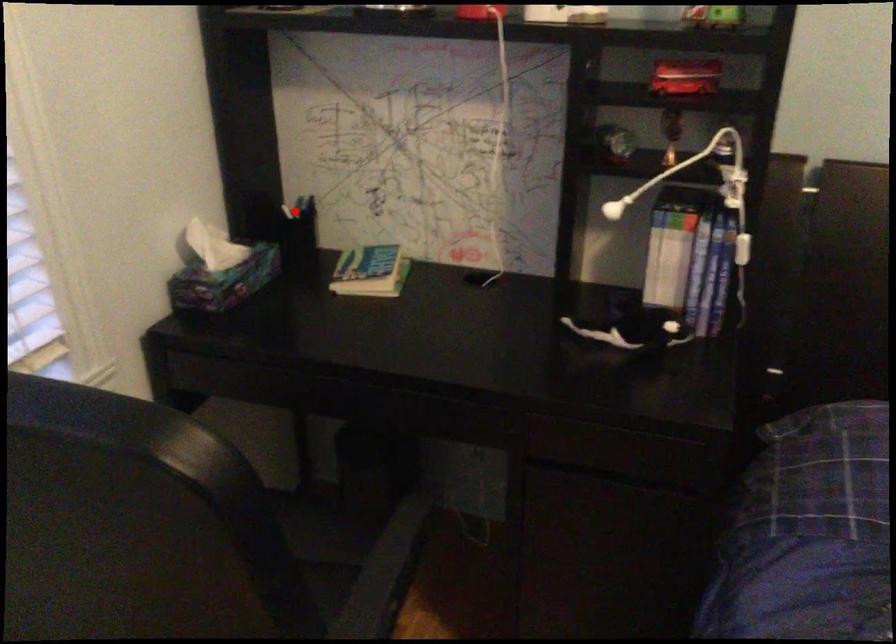
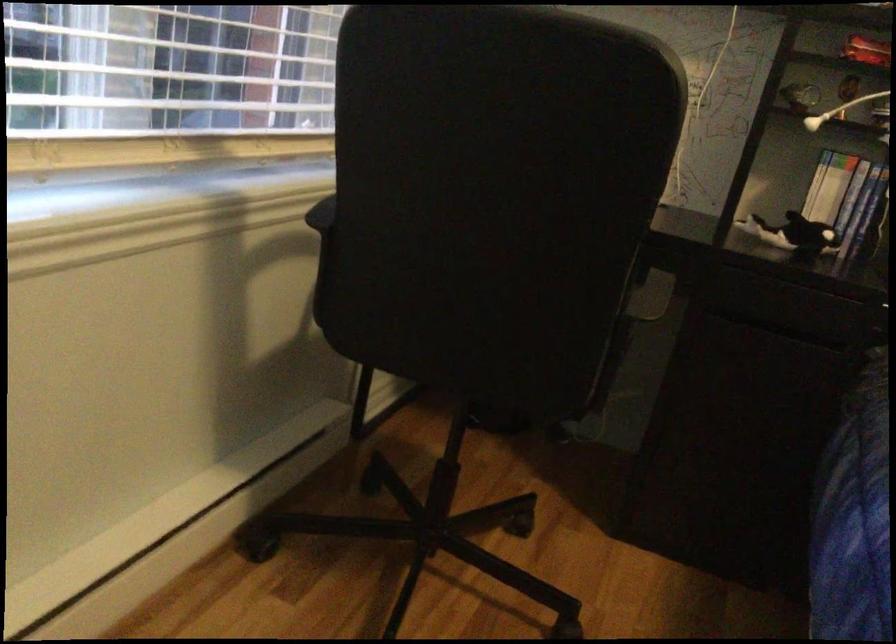
Question: I am providing you with two images of the same scene from different viewpoints. A red point is marked on the first image. Is the red point's position out of view in image 2?

Choices:
 (A) Yes
 (B) No

Answer: (A)